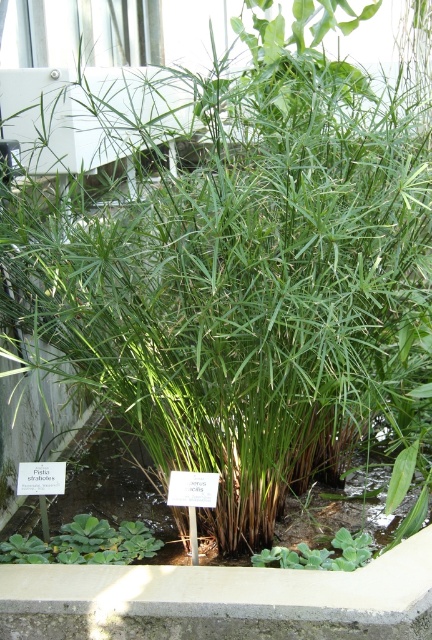
You are standing in the greenhouse and want to touch both the concrete ledge at center and the green leafy plant at lower left. Which one can you reach first without moving your position?

The concrete ledge at center is closer to the viewer than the green leafy plant at lower left, so you can reach the concrete ledge at center first without moving your position.

You are a gardener who needs to place a decorative stone on the concrete ledge at center. Considering the size of the ledge compared to the green leafy plant at lower center, do you think the ledge can accommodate the stone without overcrowding the area?

The concrete ledge at center is bigger than the green leafy plant at lower center, so it can accommodate the stone without overcrowding the area.